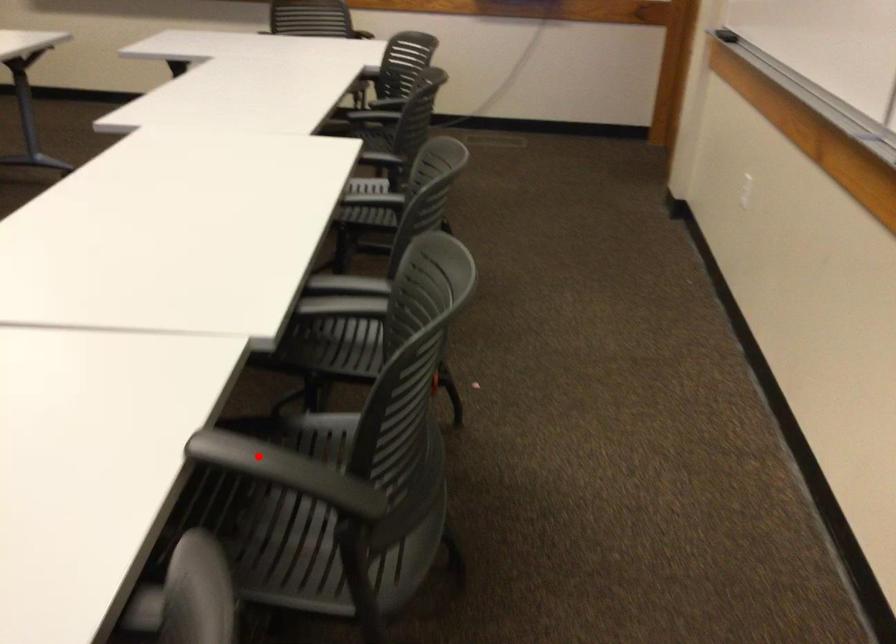
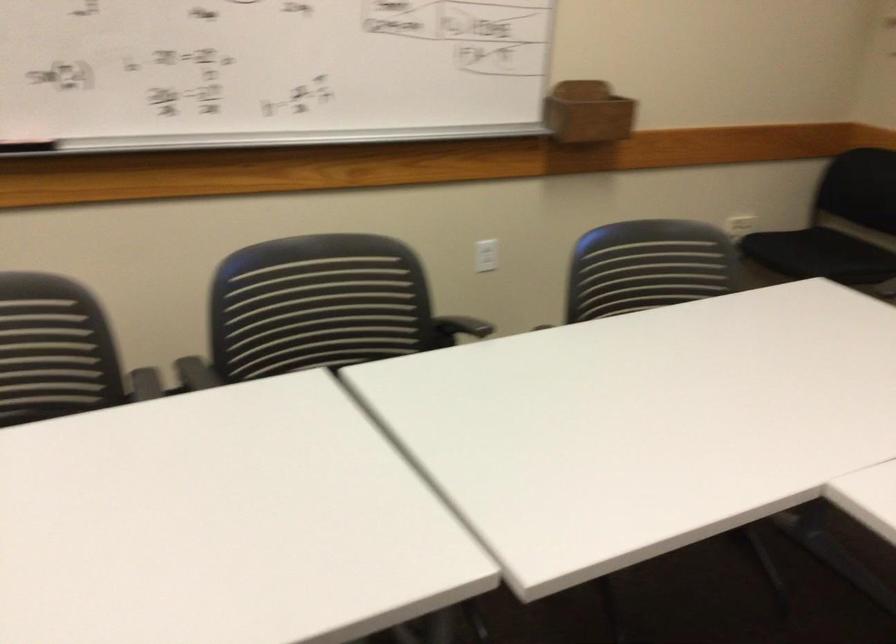
Where in the second image is the point corresponding to the highlighted location from the first image?

(458, 328)